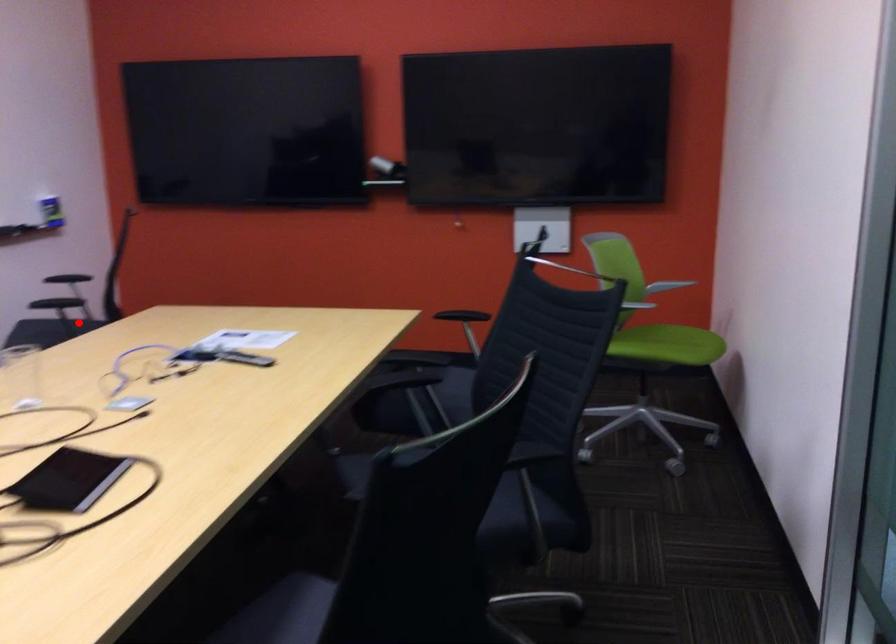
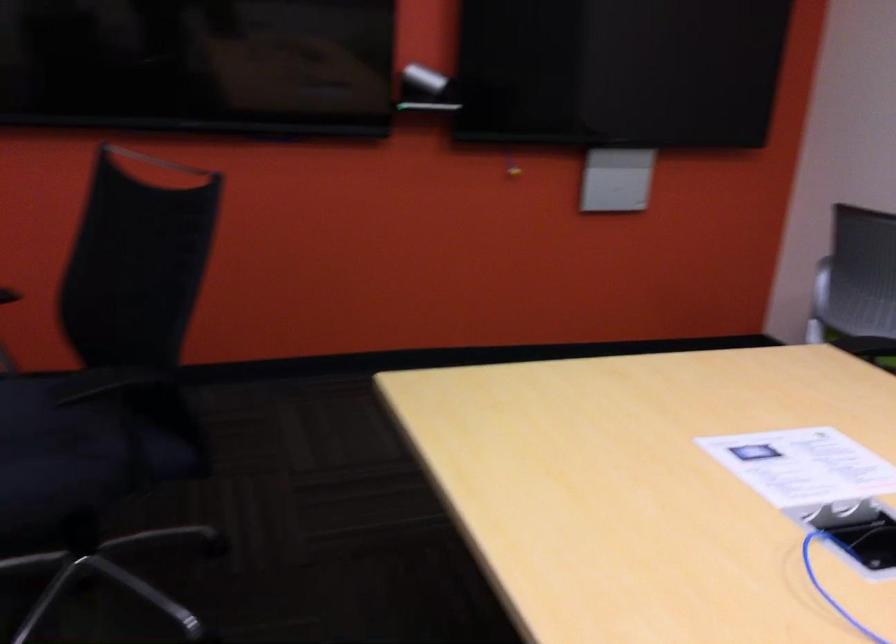
In the second image, find the point that corresponds to the highlighted location in the first image.

(82, 450)